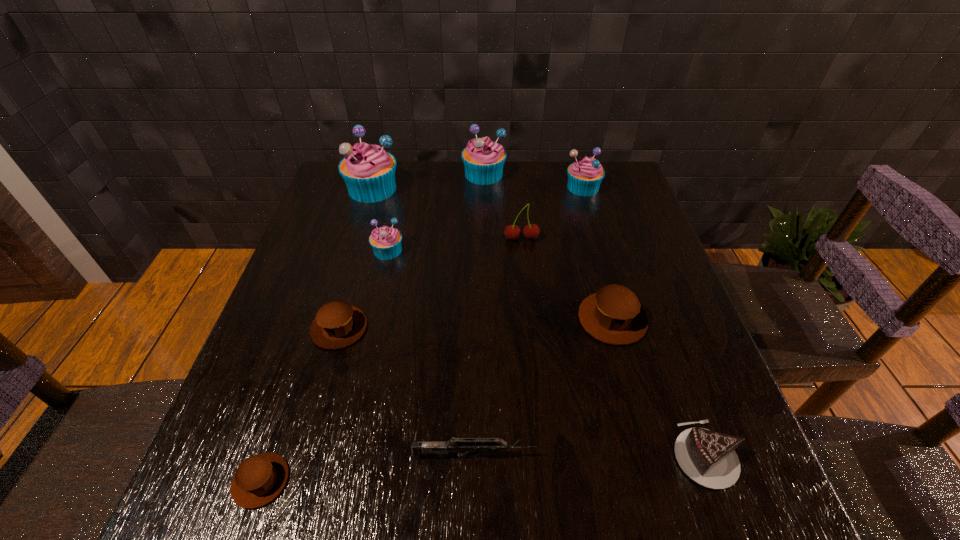
Image resolution: width=960 pixels, height=540 pixels. What are the coordinates of `free space between the gun and the biggest blue muffin` in the screenshot? It's located at (423, 322).

I want to click on empty space between the rightmost blue muffin and the biggest brown muffin, so click(597, 253).

Locate an element on the screen. vacant space that is in between the gun and the cherry is located at coordinates (497, 347).

Locate an element on the screen. The height and width of the screenshot is (540, 960). free space that is in between the chocolate cake and the cherry is located at coordinates (612, 347).

I want to click on vacant area that lies between the tallest object and the second smallest blue muffin, so click(x=478, y=188).

Identify the location of vacant space in between the third biggest blue muffin and the tallest object. (478, 188).

This screenshot has height=540, width=960. Find the location of `vacant point located between the rightmost brown muffin and the sixth tallest muffin`. vacant point located between the rightmost brown muffin and the sixth tallest muffin is located at coordinates (476, 324).

Identify the location of empty space that is in between the biggest blue muffin and the second shortest muffin. (356, 259).

Identify which object is located as the third nearest to the shortest muffin. Please provide its 2D coordinates. Your answer should be formatted as a tuple, i.e. [(x, y)], where the tuple contains the x and y coordinates of a point satisfying the conditions above.

[(386, 242)]

Identify which object is located as the second nearest to the nearest muffin. Please provide its 2D coordinates. Your answer should be formatted as a tuple, i.e. [(x, y)], where the tuple contains the x and y coordinates of a point satisfying the conditions above.

[(337, 324)]